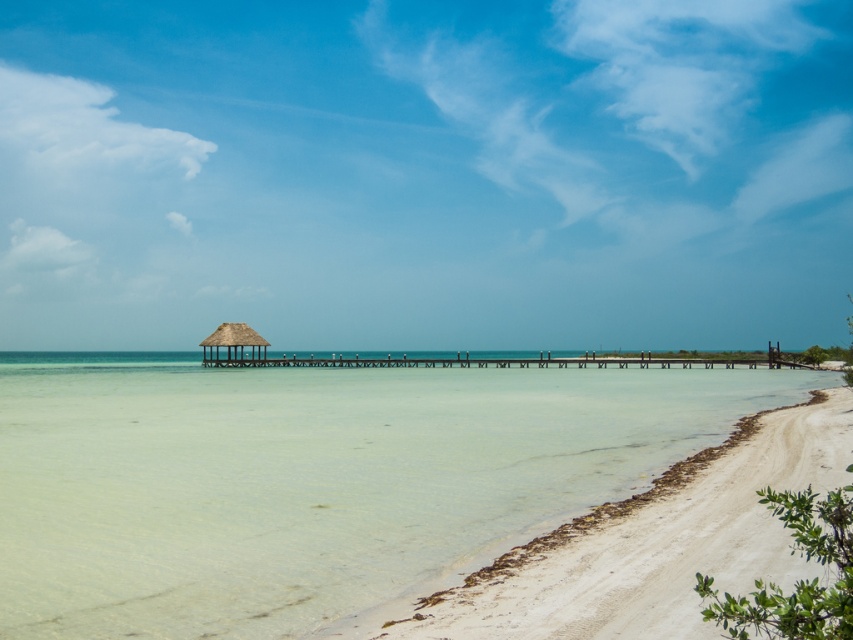
Is white sand beach at center to the right of thatched straw hut at center from the viewer's perspective?

Yes, white sand beach at center is to the right of thatched straw hut at center.

Can you confirm if white sand beach at center is positioned above thatched straw hut at center?

Actually, white sand beach at center is below thatched straw hut at center.

This screenshot has height=640, width=853. What do you see at coordinates (309, 477) in the screenshot?
I see `white sand beach at center` at bounding box center [309, 477].

Where is `white sand beach at center`? white sand beach at center is located at coordinates (309, 477).